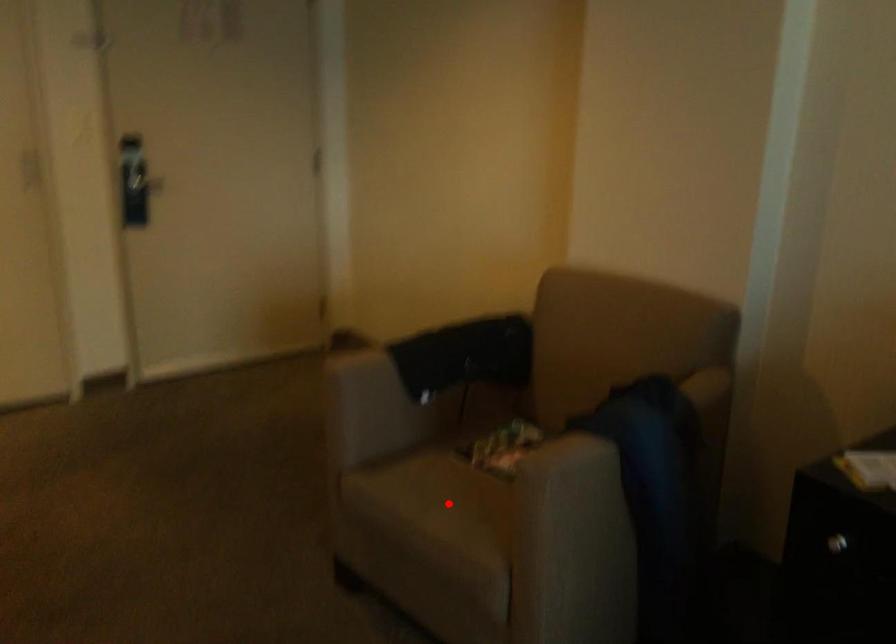
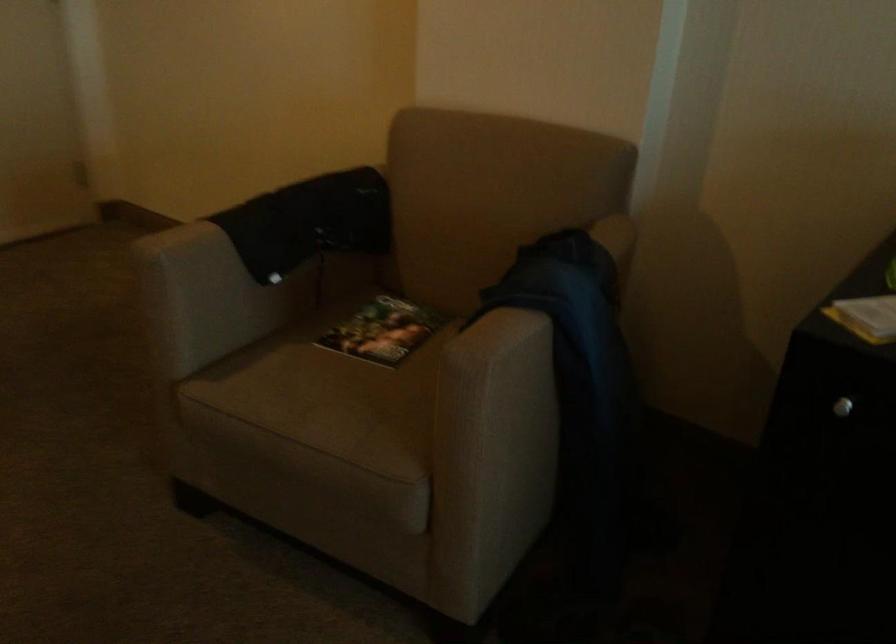
Find the pixel in the second image that matches the highlighted location in the first image.

(330, 404)